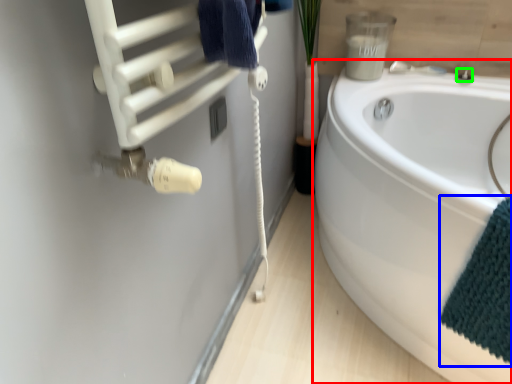
Question: Which object is positioned closest to bathtub (highlighted by a red box)? Select from bath towel (highlighted by a blue box) and faucet (highlighted by a green box).

Choices:
 (A) bath towel
 (B) faucet

Answer: (A)